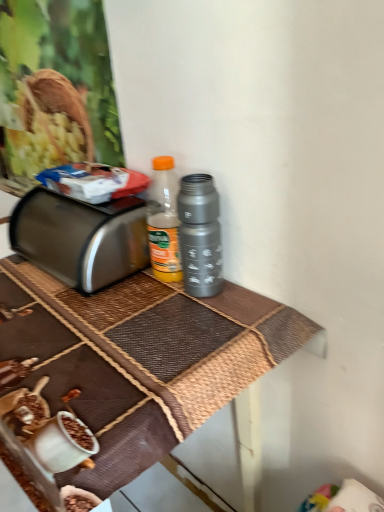
This screenshot has width=384, height=512. In order to click on free space in front of metallic gray thermos at center in this screenshot , I will do `click(192, 335)`.